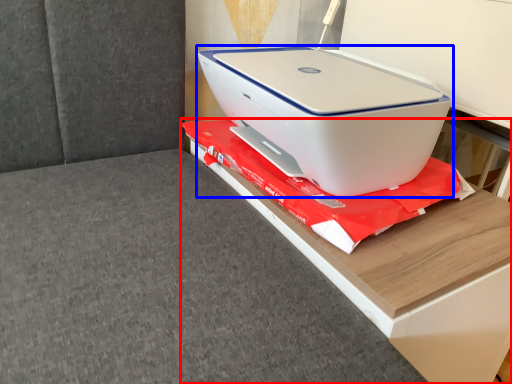
Question: Which of the following is the farthest to the observer, furniture (highlighted by a red box) or printer (highlighted by a blue box)?

Choices:
 (A) furniture
 (B) printer

Answer: (B)